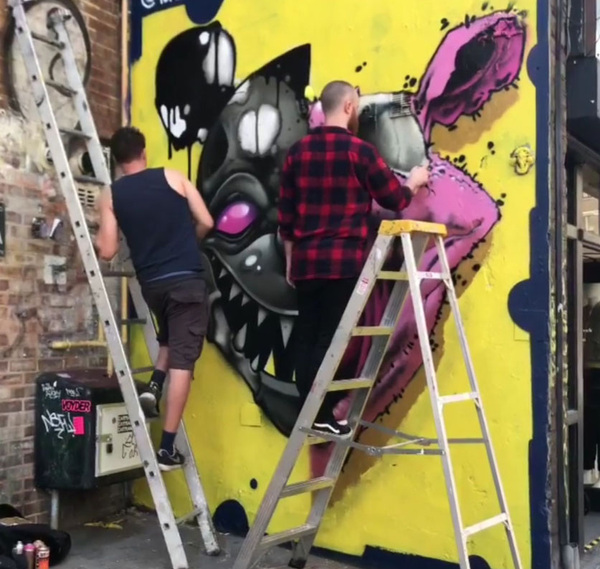
Where is `step ladder`? step ladder is located at coordinates (393, 230).